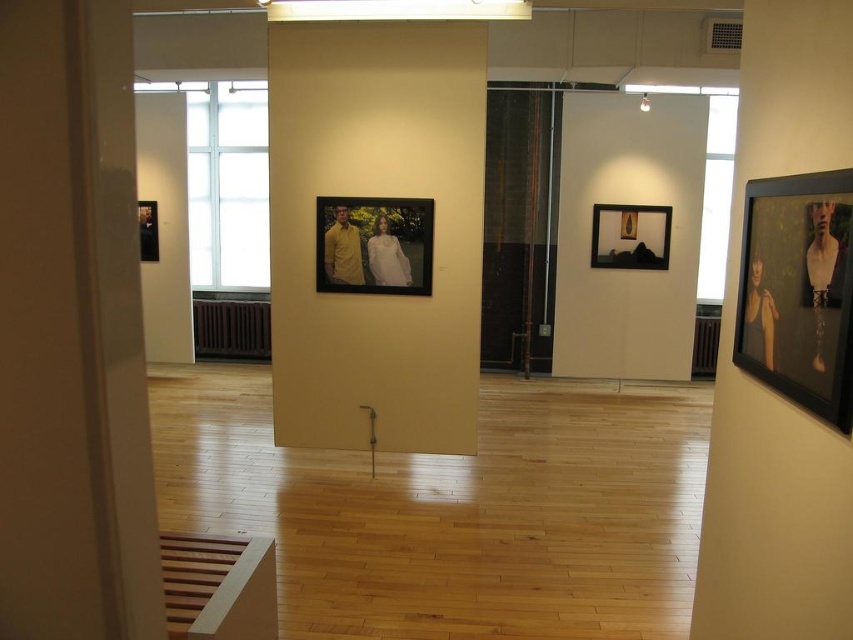
Is matte plastic picture frame at center taller than matte black portrait at left?

Correct, matte plastic picture frame at center is much taller as matte black portrait at left.

What do you see at coordinates (374, 244) in the screenshot?
I see `matte plastic picture frame at center` at bounding box center [374, 244].

Identify the location of matte plastic picture frame at center. (374, 244).

Can you confirm if black matte picture frame at right is positioned above matte plastic picture frame at center?

Actually, black matte picture frame at right is below matte plastic picture frame at center.

Who is more forward, (775,330) or (415,259)?

Point (775,330) is in front.

What do you see at coordinates (798, 291) in the screenshot? I see `black matte picture frame at right` at bounding box center [798, 291].

The image size is (853, 640). In order to click on black matte picture frame at right in this screenshot , I will do `click(798, 291)`.

I want to click on matte black picture frame at center, so click(x=630, y=236).

Does matte black picture frame at center have a lesser width compared to matte black portrait at left?

Incorrect, matte black picture frame at center's width is not less than matte black portrait at left's.

Is point (596, 205) farther from camera compared to point (148, 212)?

No, it is not.

Locate an element on the screen. The width and height of the screenshot is (853, 640). matte black picture frame at center is located at coordinates (630, 236).